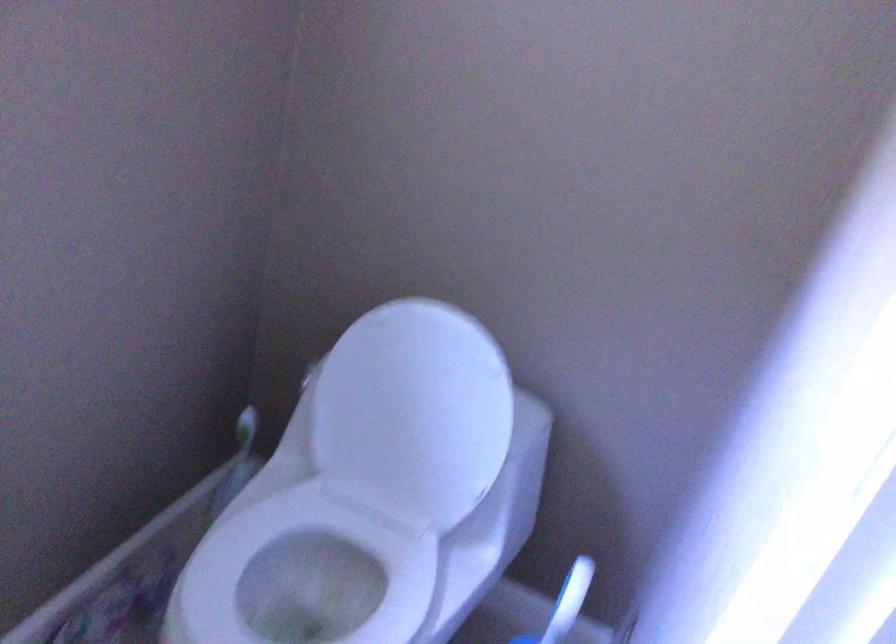
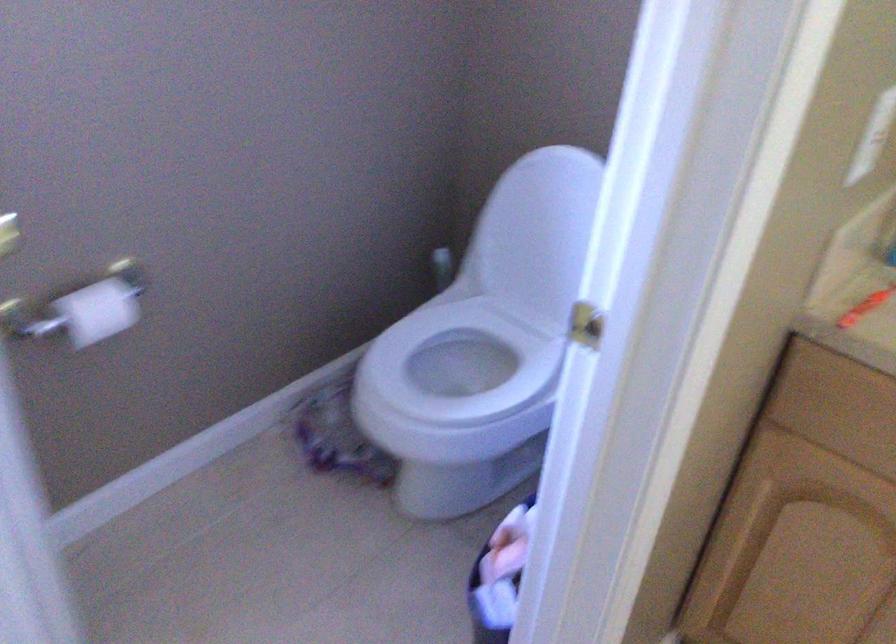
The point at [394,391] is marked in the first image. Where is the corresponding point in the second image?

(538, 228)